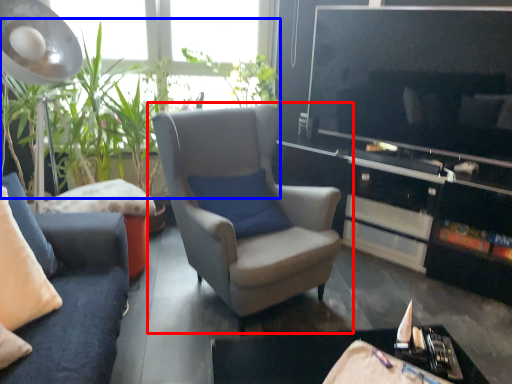
Question: Which object appears closest to the camera in this image, chair (highlighted by a red box) or vegetation (highlighted by a blue box)?

Choices:
 (A) chair
 (B) vegetation

Answer: (A)